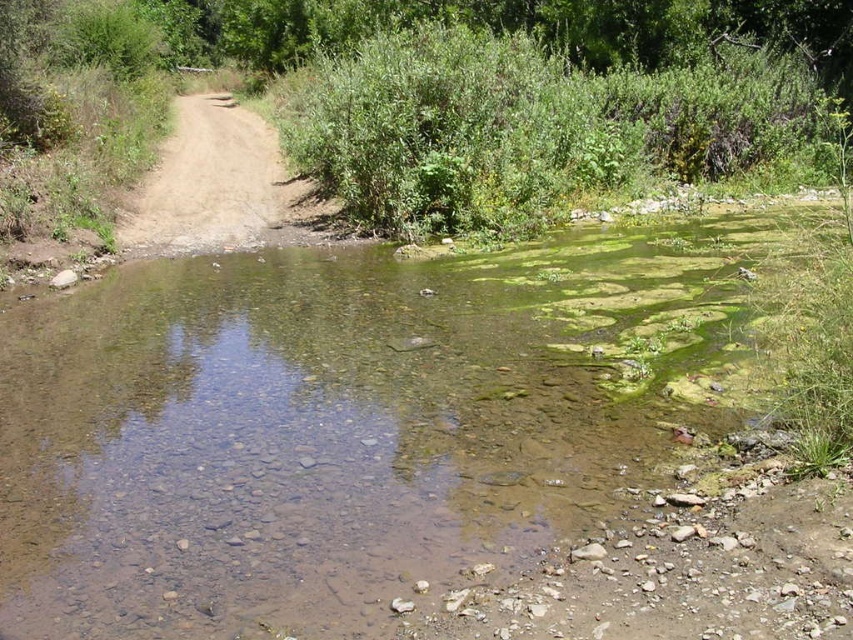
Is green algae-covered water at center wider than green mossy algae at upper right?

No, green algae-covered water at center is not wider than green mossy algae at upper right.

Is point (506, 426) less distant than point (801, 141)?

Yes.

Locate an element on the screen. This screenshot has width=853, height=640. green algae-covered water at center is located at coordinates (432, 444).

Between green mossy algae at upper right and dirt road at center, which one appears on the right side from the viewer's perspective?

green mossy algae at upper right

In the scene shown: Does green mossy algae at upper right appear on the left side of dirt road at center?

No, green mossy algae at upper right is not to the left of dirt road at center.

You are a GUI agent. You are given a task and a screenshot of the screen. Output one action in this format:
    pyautogui.click(x=<x>, y=<y>)
    Task: Click on the green mossy algae at upper right
    The height and width of the screenshot is (640, 853).
    Given the screenshot: What is the action you would take?
    pyautogui.click(x=531, y=128)

Between point (822, 547) and point (210, 198), which one is positioned in front?

Point (822, 547) is more forward.

Is point (347, 256) behind point (254, 209)?

No, (347, 256) is in front of (254, 209).

Where is `green algae-covered water at center`? green algae-covered water at center is located at coordinates (432, 444).